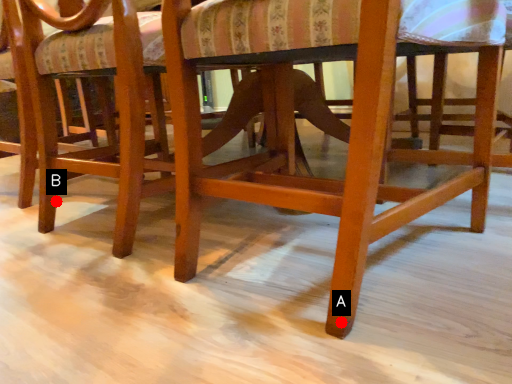
Question: Two points are circled on the image, labeled by A and B beside each circle. Which point is closer to the camera?

Choices:
 (A) A is closer
 (B) B is closer

Answer: (A)